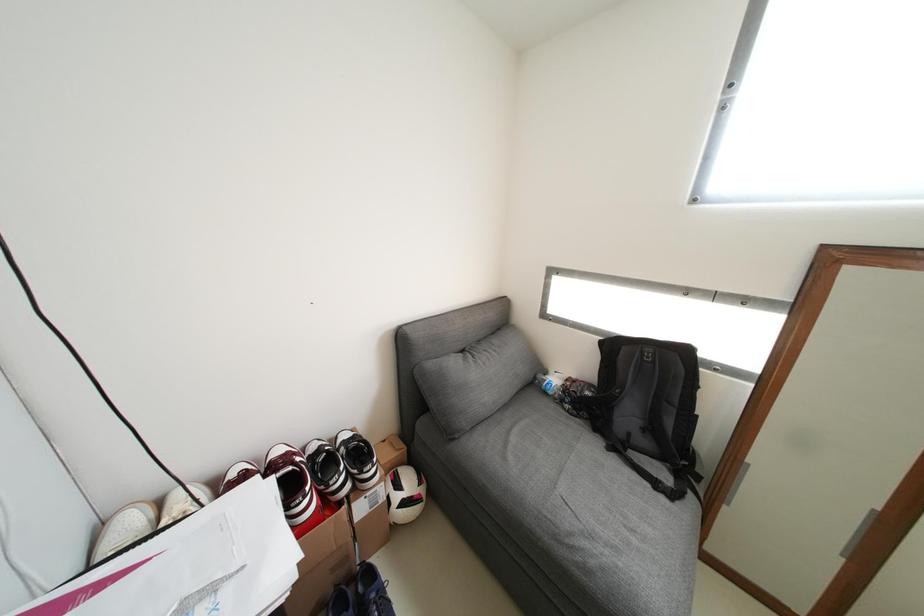
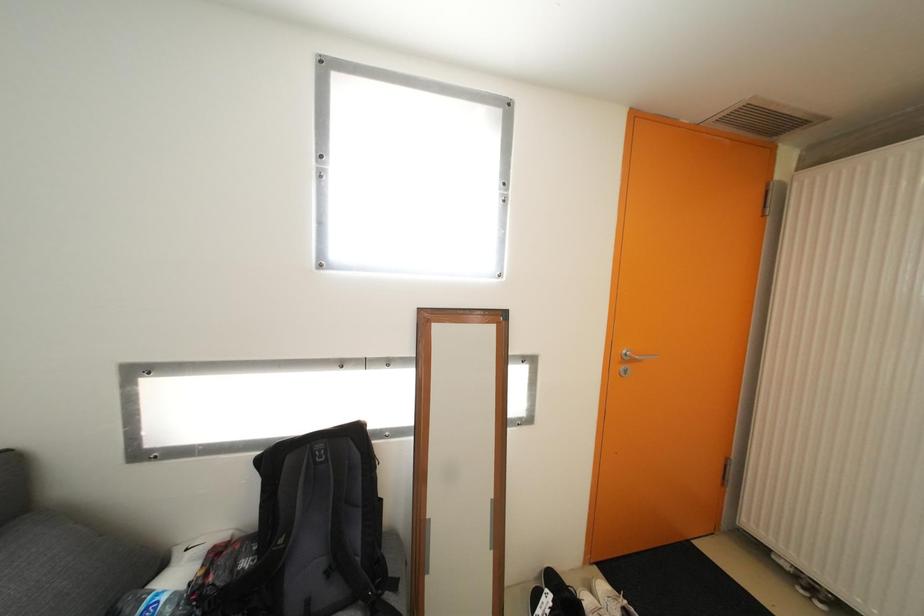
Question: The images are taken continuously from a first-person perspective. In which direction is your viewpoint rotating?

Choices:
 (A) Left
 (B) Right
 (C) Up
 (D) Down

Answer: (B)